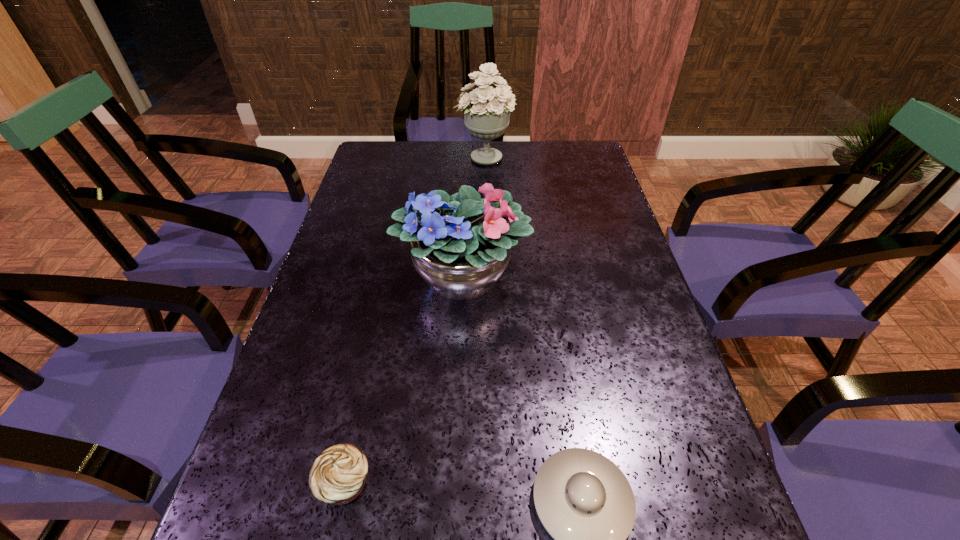
Locate an element on the screen. Image resolution: width=960 pixels, height=540 pixels. the tallest object is located at coordinates (486, 110).

Locate an element on the screen. The image size is (960, 540). the farther bouquet is located at coordinates (486, 110).

Identify the location of the shorter bouquet. The width and height of the screenshot is (960, 540). (460, 244).

Locate an element on the screen. the second tallest object is located at coordinates (460, 244).

Image resolution: width=960 pixels, height=540 pixels. What are the coordinates of `the third tallest object` in the screenshot? It's located at (338, 475).

You are a GUI agent. You are given a task and a screenshot of the screen. Output one action in this format:
    pyautogui.click(x=<x>, y=<y>)
    Task: Click on the vacant position located on the right of the tallest object
    
    Given the screenshot: What is the action you would take?
    579,157

Locate an element on the screen. This screenshot has height=540, width=960. vacant space located on the front of the nearer bouquet is located at coordinates (461, 338).

The image size is (960, 540). I want to click on vacant space located 0.100m on the left of the muffin, so click(254, 483).

The image size is (960, 540). I want to click on object present at the far edge, so click(486, 110).

Where is `object present at the left edge`? object present at the left edge is located at coordinates (x=338, y=475).